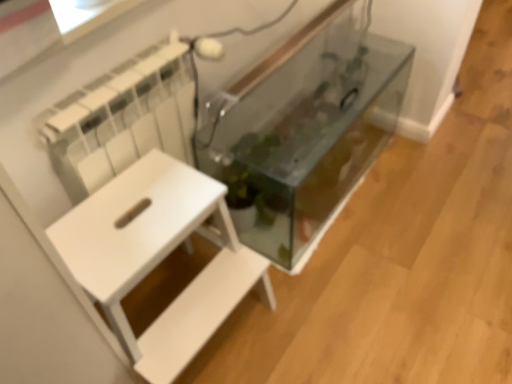
Question: Is white matte side table at left far from transparent glass tank at center?

Choices:
 (A) no
 (B) yes

Answer: (A)

Question: Can we say white matte side table at left lies outside transparent glass tank at center?

Choices:
 (A) yes
 (B) no

Answer: (A)

Question: From the image's perspective, is white matte side table at left on top of transparent glass tank at center?

Choices:
 (A) no
 (B) yes

Answer: (A)

Question: Does white matte side table at left appear on the right side of transparent glass tank at center?

Choices:
 (A) no
 (B) yes

Answer: (A)

Question: Could you tell me if white matte side table at left is turned towards transparent glass tank at center?

Choices:
 (A) no
 (B) yes

Answer: (A)

Question: From a real-world perspective, is white matte side table at left physically below transparent glass tank at center?

Choices:
 (A) yes
 (B) no

Answer: (B)

Question: Is transparent glass tank at center directly adjacent to white matte side table at left?

Choices:
 (A) yes
 (B) no

Answer: (B)

Question: Does transparent glass tank at center have a smaller size compared to white matte side table at left?

Choices:
 (A) yes
 (B) no

Answer: (B)

Question: From a real-world perspective, does transparent glass tank at center sit lower than white matte side table at left?

Choices:
 (A) no
 (B) yes

Answer: (B)

Question: Considering the relative sizes of transparent glass tank at center and white matte side table at left in the image provided, is transparent glass tank at center taller than white matte side table at left?

Choices:
 (A) no
 (B) yes

Answer: (A)

Question: Is transparent glass tank at center positioned before white matte side table at left?

Choices:
 (A) yes
 (B) no

Answer: (B)

Question: Is transparent glass tank at center shorter than white matte side table at left?

Choices:
 (A) yes
 (B) no

Answer: (A)

Question: Is transparent glass tank at center bigger or smaller than white matte side table at left?

Choices:
 (A) big
 (B) small

Answer: (A)